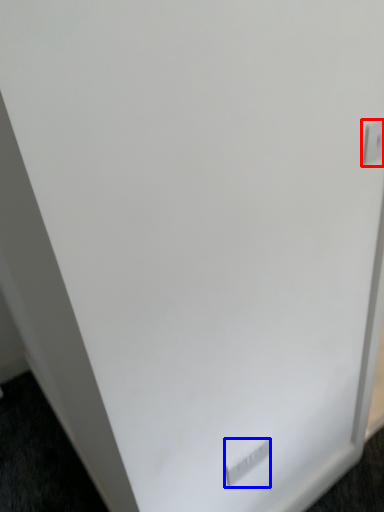
Question: Which object is further to the camera taking this photo, electric outlet (highlighted by a red box) or electric outlet (highlighted by a blue box)?

Choices:
 (A) electric outlet
 (B) electric outlet

Answer: (B)